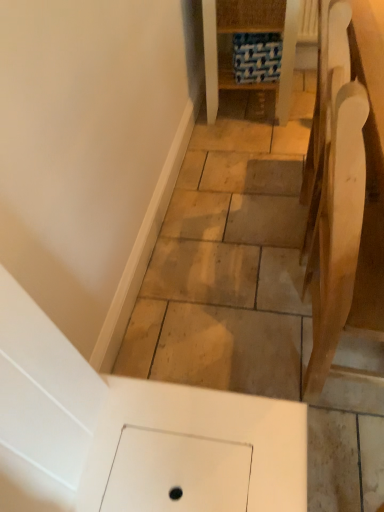
Question: Can you confirm if blue fabric at center, marked as the 1th furniture in a top-to-bottom arrangement, is thinner than light brown wood chair at right, marked as the 2th furniture in a top-to-bottom arrangement?

Choices:
 (A) yes
 (B) no

Answer: (B)

Question: From the image's perspective, is blue fabric at center, which appears as the second furniture when viewed from the front, above light brown wood chair at right, which is the 1th furniture from front to back?

Choices:
 (A) no
 (B) yes

Answer: (B)

Question: Does blue fabric at center, marked as the 1th furniture in a top-to-bottom arrangement, come behind light brown wood chair at right, marked as the 2th furniture in a top-to-bottom arrangement?

Choices:
 (A) yes
 (B) no

Answer: (A)

Question: Is light brown wood chair at right, the second furniture positioned from the back, completely or partially inside blue fabric at center, which appears as the second furniture when viewed from the front?

Choices:
 (A) no
 (B) yes

Answer: (A)

Question: From a real-world perspective, is blue fabric at center, which appears as the second furniture when viewed from the front, over light brown wood chair at right, marked as the 2th furniture in a top-to-bottom arrangement?

Choices:
 (A) no
 (B) yes

Answer: (A)

Question: From the image's perspective, would you say blue fabric at center, which appears as the second furniture when viewed from the front, is shown under light brown wood chair at right, acting as the 1th furniture starting from the bottom?

Choices:
 (A) yes
 (B) no

Answer: (B)

Question: Is light brown wood chair at right, marked as the 2th furniture in a top-to-bottom arrangement, not inside blue fabric at center, which is the first furniture in back-to-front order?

Choices:
 (A) yes
 (B) no

Answer: (A)

Question: Is light brown wood chair at right, the second furniture positioned from the back, in front of blue fabric at center, the 2th furniture when ordered from bottom to top?

Choices:
 (A) yes
 (B) no

Answer: (A)

Question: From a real-world perspective, is light brown wood chair at right, the second furniture positioned from the back, over blue fabric at center, marked as the 1th furniture in a top-to-bottom arrangement?

Choices:
 (A) no
 (B) yes

Answer: (B)

Question: Considering the relative sizes of light brown wood chair at right, the second furniture positioned from the back, and blue fabric at center, which appears as the second furniture when viewed from the front, in the image provided, is light brown wood chair at right, the second furniture positioned from the back, smaller than blue fabric at center, which appears as the second furniture when viewed from the front,?

Choices:
 (A) yes
 (B) no

Answer: (A)

Question: Is light brown wood chair at right, which is the 1th furniture from front to back, far from blue fabric at center, which appears as the second furniture when viewed from the front?

Choices:
 (A) no
 (B) yes

Answer: (B)

Question: Can you confirm if light brown wood chair at right, the second furniture positioned from the back, is positioned to the right of blue fabric at center, which is the first furniture in back-to-front order?

Choices:
 (A) yes
 (B) no

Answer: (A)

Question: Is point (211, 31) closer or farther from the camera than point (306, 395)?

Choices:
 (A) closer
 (B) farther

Answer: (B)